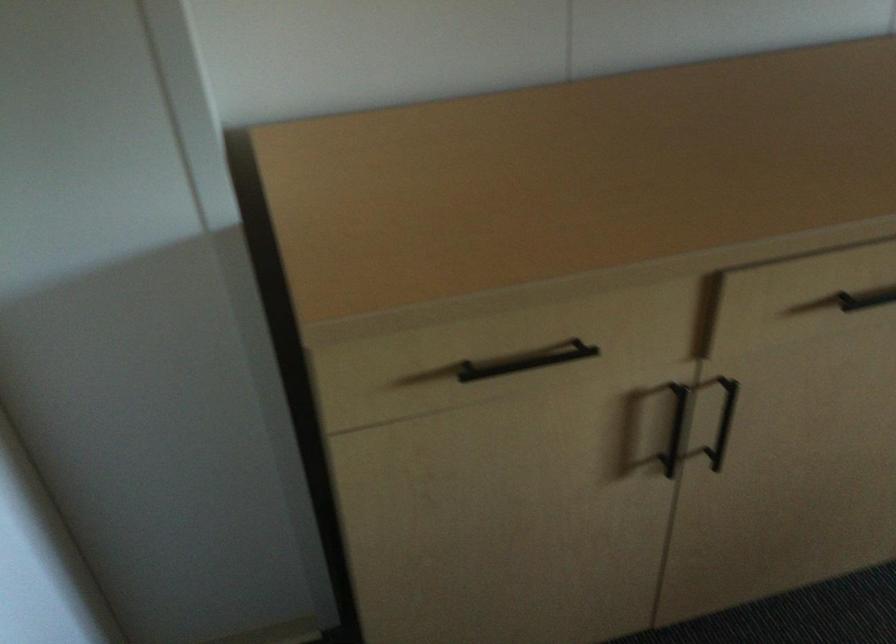
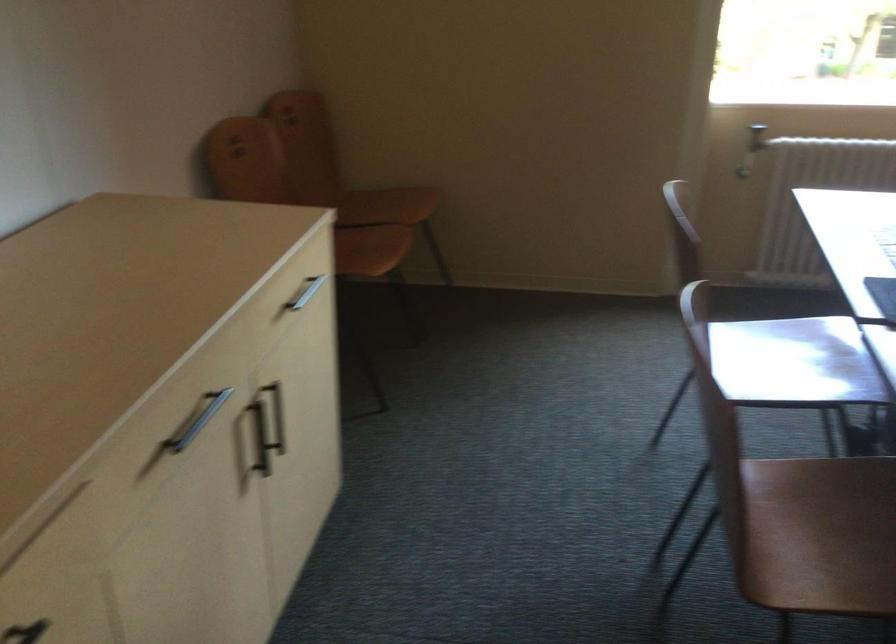
Question: The first image is from the beginning of the video and the second image is from the end. How did the camera likely rotate when shooting the video?

Choices:
 (A) Left
 (B) Right
 (C) Up
 (D) Down

Answer: (B)